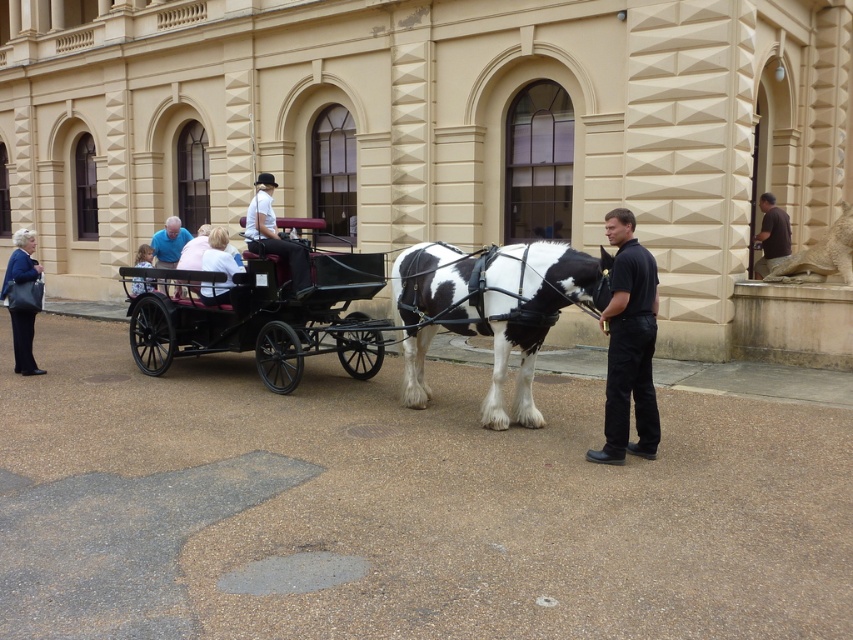
Can you confirm if black smooth shirt at center is positioned to the right of blue shirt at center?

Indeed, black smooth shirt at center is positioned on the right side of blue shirt at center.

Who is lower down, black smooth shirt at center or blue shirt at center?

black smooth shirt at center is below.

Which is behind, point (613, 269) or point (177, 252)?

Point (177, 252)

Locate an element on the screen. The width and height of the screenshot is (853, 640). black smooth shirt at center is located at coordinates coord(628,344).

Is point (247, 209) positioned before point (148, 284)?

No.

Does white cotton shirt at center appear over light blue shirt at center?

Yes, white cotton shirt at center is above light blue shirt at center.

Is point (265, 234) more distant than point (138, 288)?

No, it is in front of (138, 288).

The height and width of the screenshot is (640, 853). I want to click on white cotton shirt at center, so click(274, 236).

Is black polished wood horse cart at center to the left of blue shirt at center from the viewer's perspective?

Incorrect, black polished wood horse cart at center is not on the left side of blue shirt at center.

Looking at this image, who is positioned more to the right, black polished wood horse cart at center or blue shirt at center?

black polished wood horse cart at center

Who is more forward, [273,253] or [177,248]?

Point [273,253]

Image resolution: width=853 pixels, height=640 pixels. I want to click on black polished wood horse cart at center, so click(x=262, y=316).